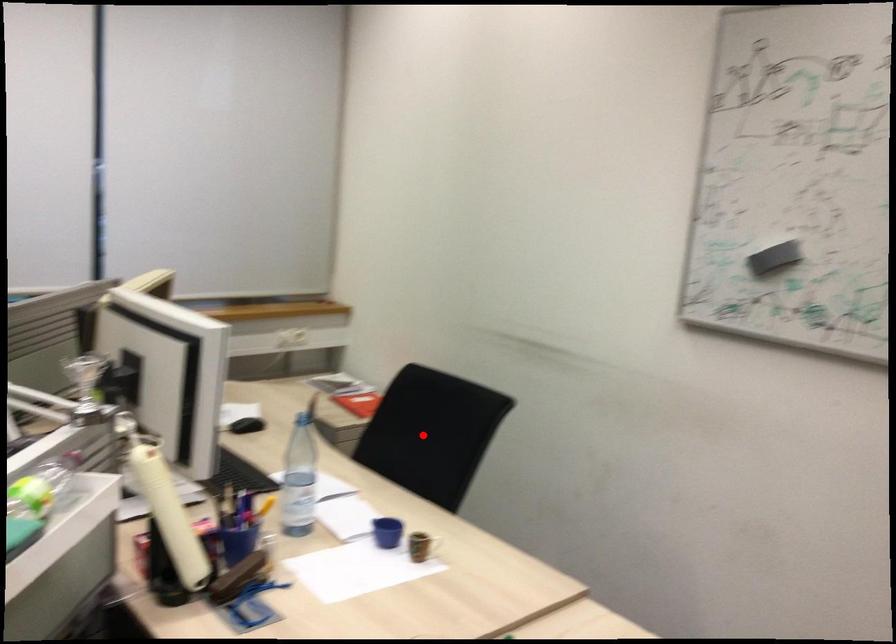
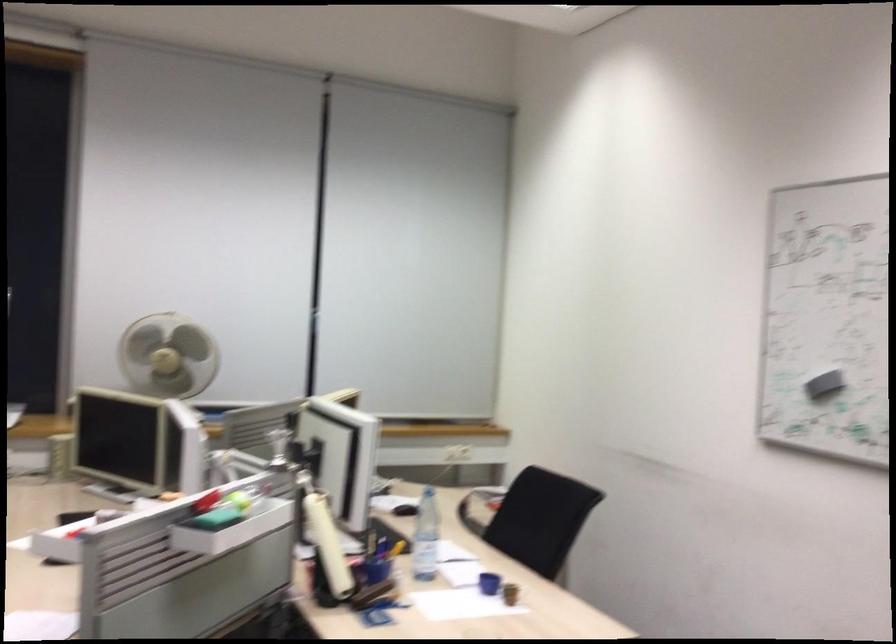
Question: I am providing you with two images of the same scene from different viewpoints. Given a red point in image1, look at the same physical point in image2. Is it:

Choices:
 (A) Closer to the viewpoint
 (B) Farther from the viewpoint

Answer: (B)